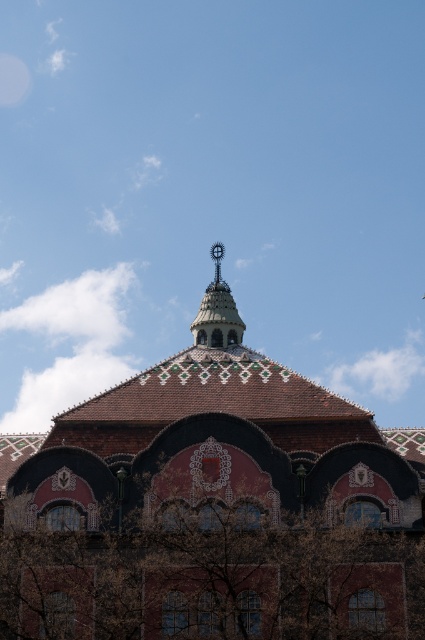
Question: Is reddish-brown tiled roof at center bigger than metallic spire at center?

Choices:
 (A) yes
 (B) no

Answer: (A)

Question: Which of the following is the farthest from the observer?

Choices:
 (A) reddish-brown tiled roof at center
 (B) metallic spire at center

Answer: (B)

Question: Among these objects, which one is farthest from the camera?

Choices:
 (A) metallic spire at center
 (B) reddish-brown tiled roof at center

Answer: (A)

Question: Does reddish-brown tiled roof at center have a greater width compared to metallic spire at center?

Choices:
 (A) no
 (B) yes

Answer: (B)

Question: Can you confirm if reddish-brown tiled roof at center is positioned below metallic spire at center?

Choices:
 (A) yes
 (B) no

Answer: (A)